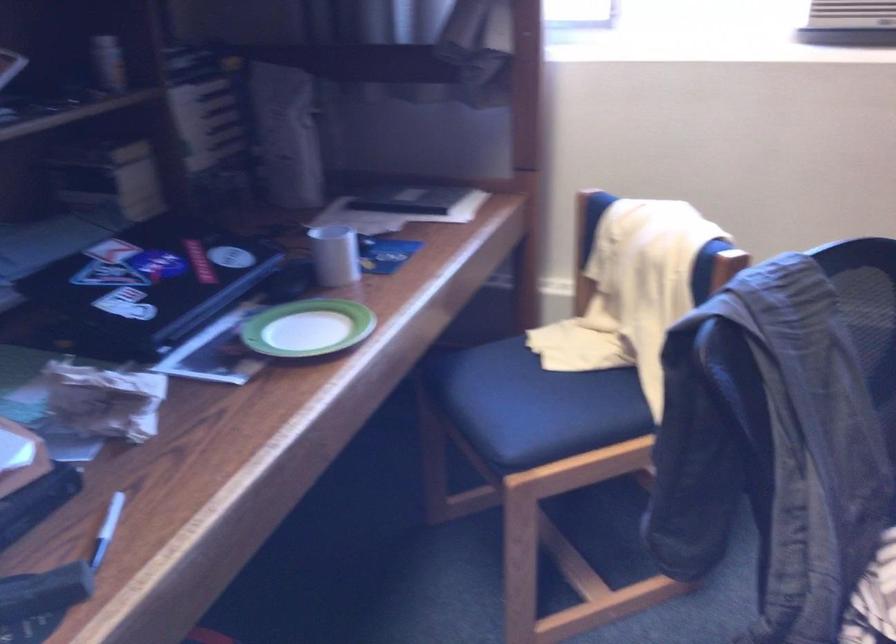
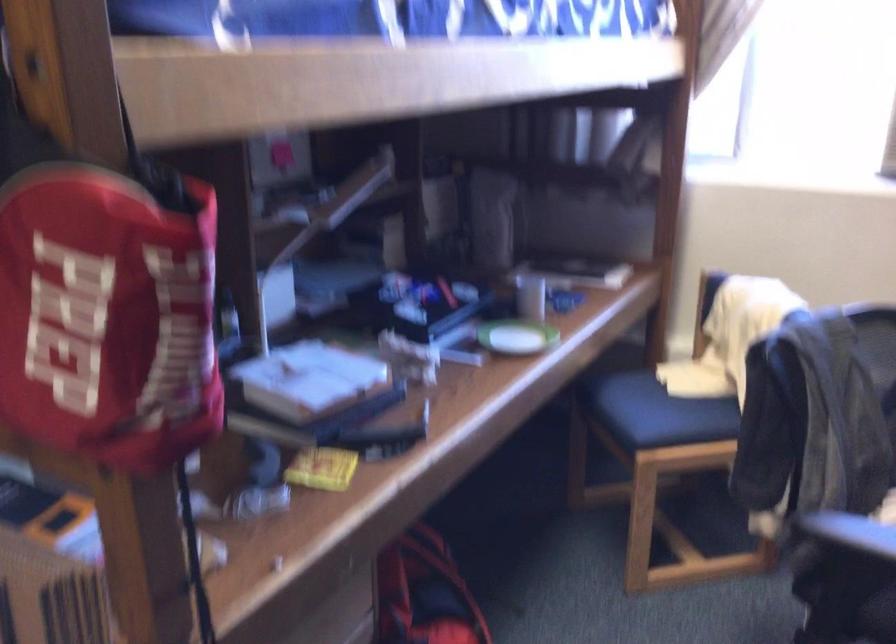
Where in the second image is the point corresponding to [552,410] from the first image?

(668, 415)